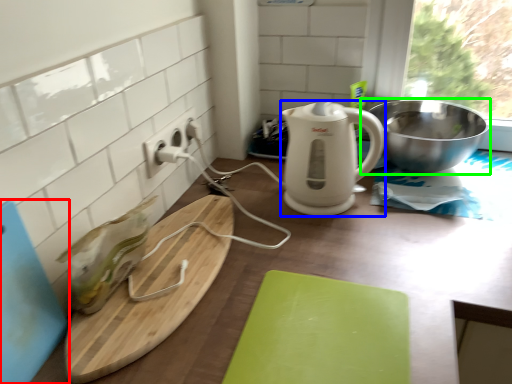
Question: Which object is positioned closest to cutting board (highlighted by a red box)? Select from kitchen appliance (highlighted by a blue box) and bowl (highlighted by a green box).

Choices:
 (A) kitchen appliance
 (B) bowl

Answer: (A)